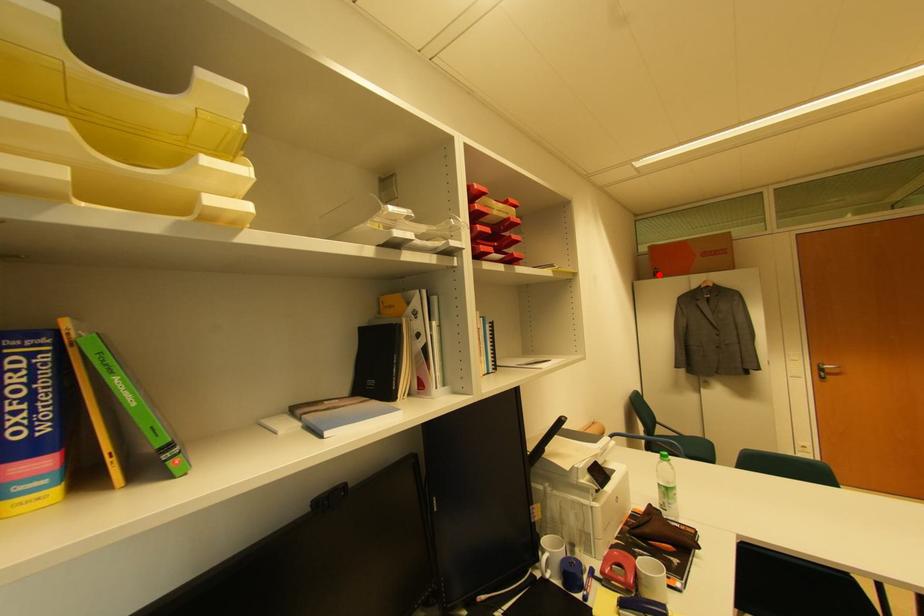
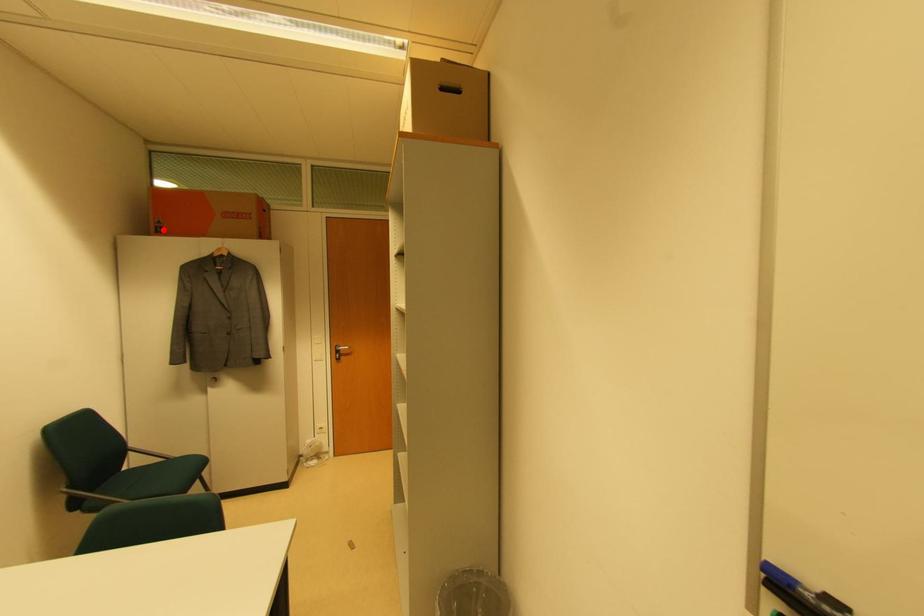
I am providing you with two images of the same scene from different viewpoints. A red point is marked on the first image and another point is marked on the second image. Are the points marked in image1 and image2 representing the same 3D position?

Yes